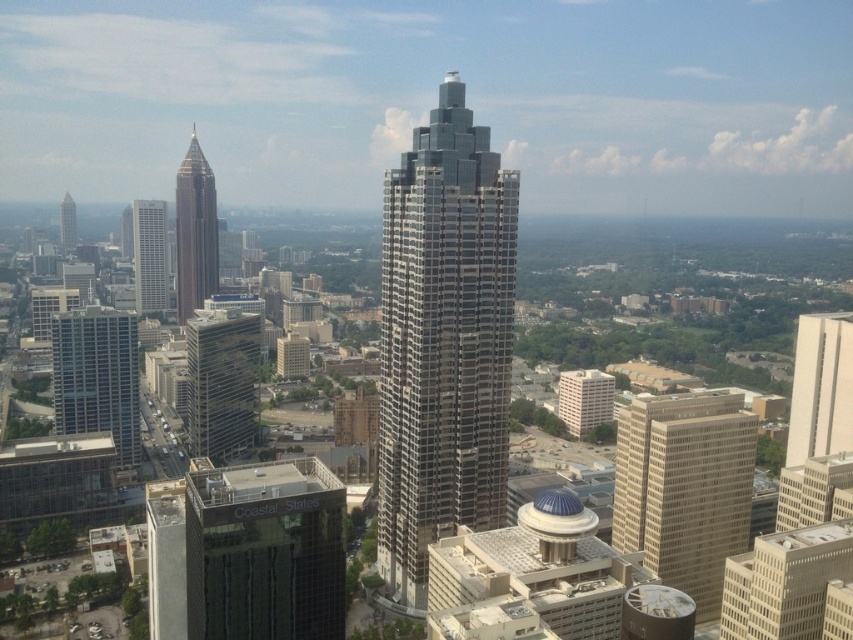
Question: Does beige concrete building at center-right appear over shiny glass skyscraper at center-left?

Choices:
 (A) no
 (B) yes

Answer: (A)

Question: Among these points, which one is nearest to the camera?

Choices:
 (A) (111, 424)
 (B) (614, 454)
 (C) (74, 221)
 (D) (817, 605)

Answer: (D)

Question: Which of the following is the closest to the observer?

Choices:
 (A) sleek glass skyscraper at center
 (B) beige concrete building at center-right

Answer: (B)

Question: Which point appears closest to the camera in this image?

Choices:
 (A) (229, 337)
 (B) (286, 477)
 (C) (62, 244)

Answer: (B)

Question: From the image, what is the correct spatial relationship of sleek glass skyscraper at center in relation to glassy reflective skyscraper at center-left?

Choices:
 (A) below
 (B) above

Answer: (B)

Question: Is sleek glass skyscraper at center wider than white concrete building at center-right?

Choices:
 (A) yes
 (B) no

Answer: (A)